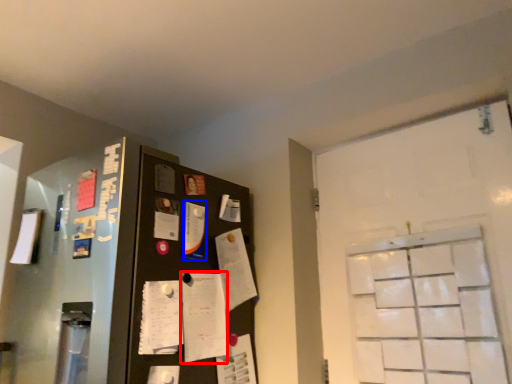
Question: Which of the following is the closest to the observer, notepad (highlighted by a red box) or paper (highlighted by a blue box)?

Choices:
 (A) notepad
 (B) paper

Answer: (A)